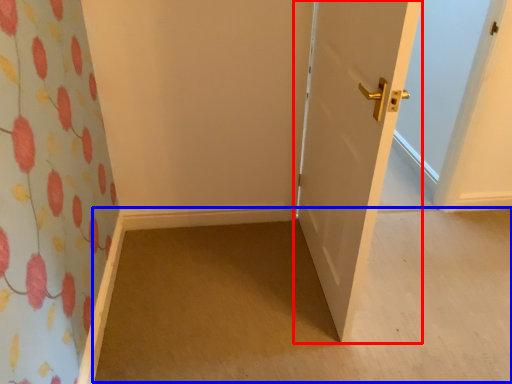
Question: Which object appears farthest to the camera in this image, door (highlighted by a red box) or plain (highlighted by a blue box)?

Choices:
 (A) door
 (B) plain

Answer: (B)